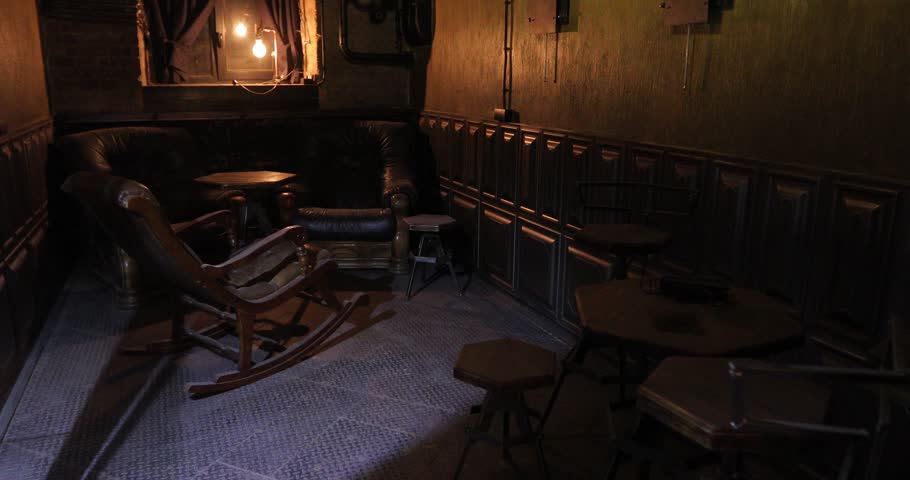
Locate an element on the screen. This screenshot has width=910, height=480. floor is located at coordinates click(x=315, y=416).